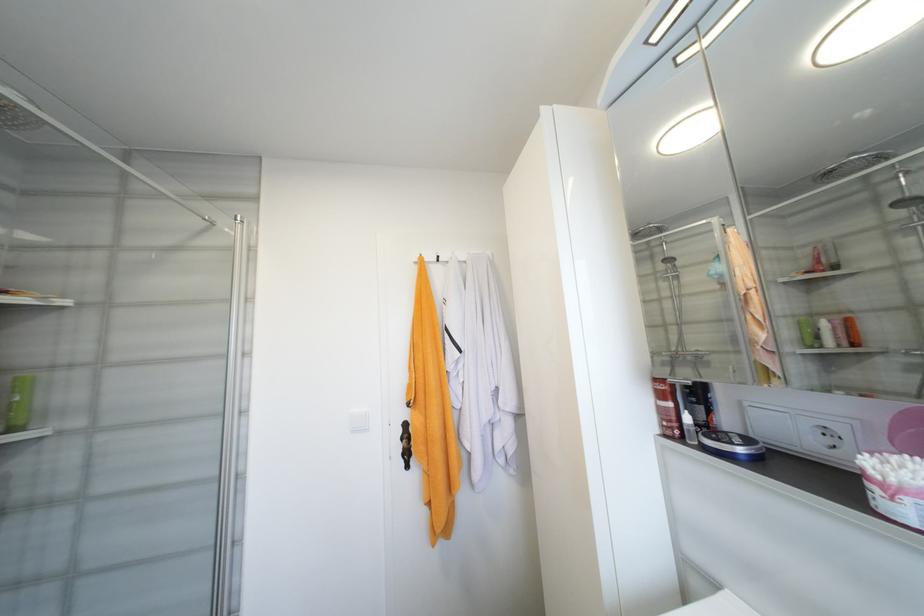
The width and height of the screenshot is (924, 616). Find the location of `power outlet socket`. power outlet socket is located at coordinates (827, 437).